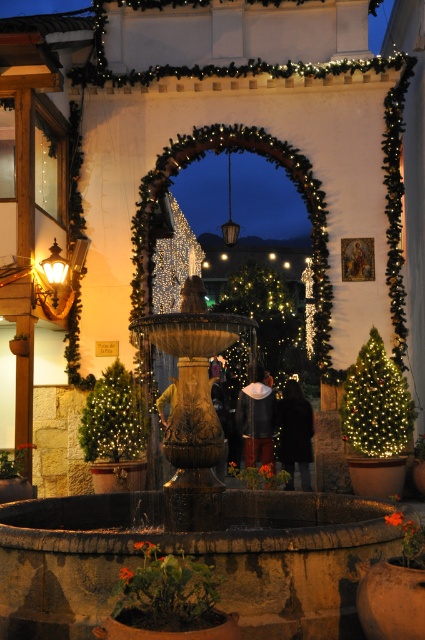
Can you confirm if green matte christmas tree at right is smaller than green matte christmas tree at lower left?

Actually, green matte christmas tree at right might be larger than green matte christmas tree at lower left.

Measure the distance from green matte christmas tree at right to green matte christmas tree at lower left.

green matte christmas tree at right is 3.11 meters from green matte christmas tree at lower left.

Is point (410, 428) positioned before point (129, 380)?

Yes, point (410, 428) is closer to viewer.

Image resolution: width=425 pixels, height=640 pixels. What are the coordinates of `green matte christmas tree at right` in the screenshot? It's located at (376, 403).

What do you see at coordinates (294, 433) in the screenshot?
I see `black fabric at center` at bounding box center [294, 433].

Measure the distance from black fabric at center to dark gray knit hat at center.

black fabric at center and dark gray knit hat at center are 17.49 inches apart.

The width and height of the screenshot is (425, 640). I want to click on black fabric at center, so click(294, 433).

Where is `black fabric at center`? Image resolution: width=425 pixels, height=640 pixels. black fabric at center is located at coordinates (294, 433).

Between green matte christmas tree at right and black fabric at center, which one appears on the left side from the viewer's perspective?

black fabric at center is more to the left.

Who is lower down, green matte christmas tree at right or black fabric at center?

black fabric at center is below.

Find the location of a particular element. This screenshot has height=640, width=425. green matte christmas tree at right is located at coordinates (376, 403).